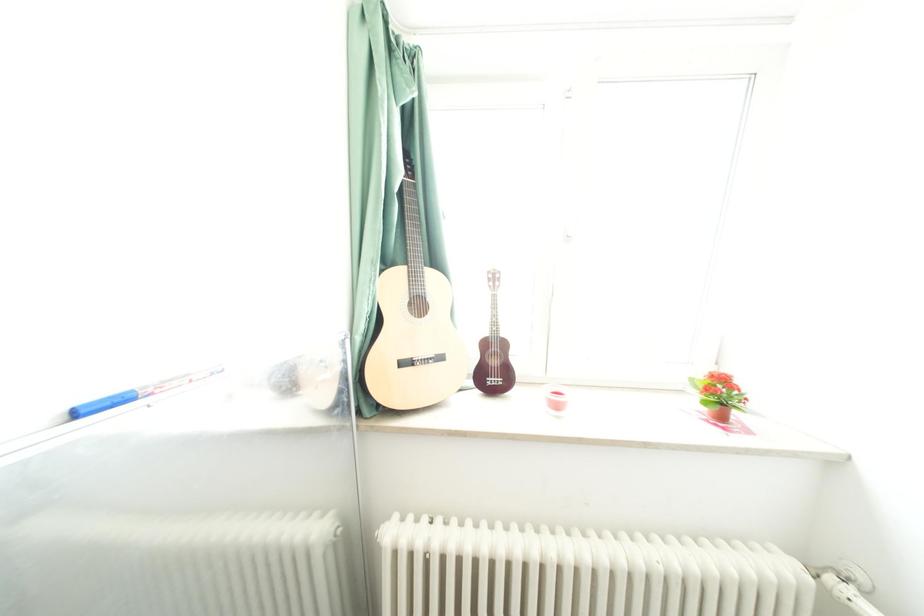
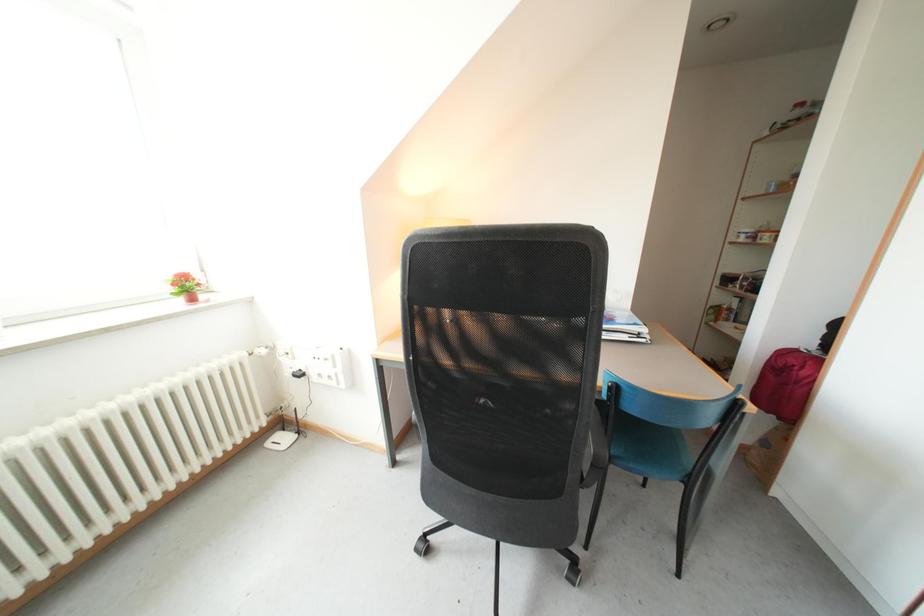
First-person continuous shooting, in which direction is the camera rotating?

The camera's rotation is toward right-down.